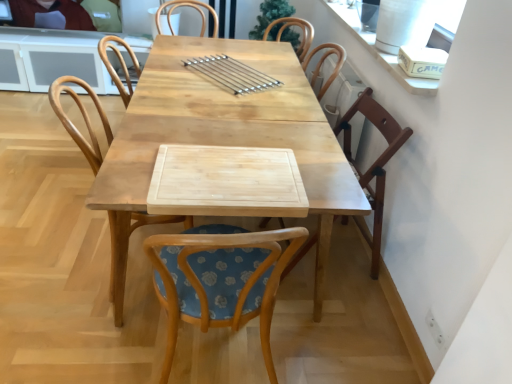
Identify the location of matte black laptop at upper left. (50, 15).

In order to face woodenchair at center, which is counted as the 2th chair, starting from the right, should I rotate leftwards or rightwards?

You should look left and rotate roughly 4.439 degrees.

The height and width of the screenshot is (384, 512). Describe the element at coordinates (221, 139) in the screenshot. I see `natural wood table at center` at that location.

Image resolution: width=512 pixels, height=384 pixels. In order to click on natural wood table at center in this screenshot , I will do `click(221, 139)`.

The height and width of the screenshot is (384, 512). What do you see at coordinates (232, 73) in the screenshot?
I see `satin silver skewers at center` at bounding box center [232, 73].

This screenshot has height=384, width=512. Find the location of `wooden chair at right, which ranks as the 1th chair in right-to-left order`. wooden chair at right, which ranks as the 1th chair in right-to-left order is located at coordinates (373, 164).

Find the location of a particular element. matte black laptop at upper left is located at coordinates (50, 15).

Does wooden chair at right, positioned as the third chair in left-to-right order, touch matte black laptop at upper left?

No, wooden chair at right, positioned as the third chair in left-to-right order, is not touching matte black laptop at upper left.

Which of these two, wooden chair at right, which ranks as the 1th chair in right-to-left order, or matte black laptop at upper left, stands taller?

wooden chair at right, which ranks as the 1th chair in right-to-left order.

From the image's perspective, which chair is the 1st one below the matte black laptop at upper left? Please provide its 2D coordinates.

[(373, 164)]

Is wooden chair at right, which ranks as the 1th chair in right-to-left order, not inside matte black laptop at upper left?

Yes, wooden chair at right, which ranks as the 1th chair in right-to-left order, is not within matte black laptop at upper left.

Between woodenchair at center, which is counted as the 2th chair, starting from the right, and matte black laptop at upper left, which one is positioned behind?

matte black laptop at upper left.

Does woodenchair at center, which is the 2th chair in left-to-right order, turn towards matte black laptop at upper left?

No, woodenchair at center, which is the 2th chair in left-to-right order, is not oriented towards matte black laptop at upper left.

Is woodenchair at center, which is the 2th chair in left-to-right order, far away from matte black laptop at upper left?

That's right, there is a large distance between woodenchair at center, which is the 2th chair in left-to-right order, and matte black laptop at upper left.

Which of these two, woodenchair at center, which is the 2th chair in left-to-right order, or matte black laptop at upper left, is bigger?

With larger size is woodenchair at center, which is the 2th chair in left-to-right order.

Which is more to the right, natural wood table at center or woodenchair at center, which is counted as the 2th chair, starting from the right?

woodenchair at center, which is counted as the 2th chair, starting from the right.

Is point (274, 66) closer or farther from the camera than point (239, 289)?

Point (274, 66).

Based on their sizes in the image, would you say natural wood table at center is bigger or smaller than woodenchair at center, which is counted as the 2th chair, starting from the right?

Considering their sizes, natural wood table at center takes up more space than woodenchair at center, which is counted as the 2th chair, starting from the right.

You are a GUI agent. You are given a task and a screenshot of the screen. Output one action in this format:
    pyautogui.click(x=<x>, y=<y>)
    Task: Click on the table behind the woodenchair at center, which is the 2th chair in left-to-right order
    The image size is (512, 384).
    Given the screenshot: What is the action you would take?
    pyautogui.click(x=221, y=139)

From their relative heights in the image, would you say matte black laptop at upper left is taller or shorter than woodenchair at center, which is the 2th chair in left-to-right order?

matte black laptop at upper left is shorter than woodenchair at center, which is the 2th chair in left-to-right order.

Is matte black laptop at upper left far from woodenchair at center, which is counted as the 2th chair, starting from the right?

matte black laptop at upper left is positioned a significant distance from woodenchair at center, which is counted as the 2th chair, starting from the right.

From a real-world perspective, which object stands above the other?

matte black laptop at upper left, from a real-world perspective.

Where is `the 2nd chair positioned below the matte black laptop at upper left (from a real-world perspective)`? This screenshot has width=512, height=384. the 2nd chair positioned below the matte black laptop at upper left (from a real-world perspective) is located at coordinates (127, 248).

Considering the sizes of objects wooden chair at center, which is counted as the first chair, starting from the left, and matte black laptop at upper left in the image provided, who is smaller, wooden chair at center, which is counted as the first chair, starting from the left, or matte black laptop at upper left?

matte black laptop at upper left.

How much distance is there between wooden chair at center, which is the third chair from right to left, and matte black laptop at upper left?

wooden chair at center, which is the third chair from right to left, and matte black laptop at upper left are 7.04 feet apart.

Is wooden chair at center, which is the third chair from right to left, to the right of matte black laptop at upper left from the viewer's perspective?

Correct, you'll find wooden chair at center, which is the third chair from right to left, to the right of matte black laptop at upper left.

Which is farther from the camera, (12, 12) or (185, 217)?

Point (12, 12)

Is matte black laptop at upper left positioned with its back to wooden chair at center, which is the third chair from right to left?

matte black laptop at upper left is not turned away from wooden chair at center, which is the third chair from right to left.

How distant is matte black laptop at upper left from wooden chair at center, which is counted as the first chair, starting from the left?

matte black laptop at upper left and wooden chair at center, which is counted as the first chair, starting from the left, are 2.15 meters apart from each other.

Does matte black laptop at upper left have a smaller size compared to wooden chair at center, which is counted as the first chair, starting from the left?

Correct, matte black laptop at upper left occupies less space than wooden chair at center, which is counted as the first chair, starting from the left.

I want to click on table below the satin silver skewers at center (from a real-world perspective), so click(221, 139).

Can you confirm if natural wood table at center is wider than satin silver skewers at center?

Correct, the width of natural wood table at center exceeds that of satin silver skewers at center.

How different are the orientations of natural wood table at center and satin silver skewers at center in degrees?

The facing directions of natural wood table at center and satin silver skewers at center are 34.1 degrees apart.

From the picture: Can you confirm if natural wood table at center is shorter than satin silver skewers at center?

No, natural wood table at center is not shorter than satin silver skewers at center.

From a real-world perspective, which chair is the 3rd one underneath the matte black laptop at upper left? Please provide its 2D coordinates.

[(373, 164)]

Which chair is the 3rd one when counting from the front of the matte black laptop at upper left? Please provide its 2D coordinates.

[(220, 279)]

Considering their positions, is matte black laptop at upper left positioned closer to natural wood table at center than satin silver skewers at center?

The object closer to natural wood table at center is satin silver skewers at center.

Based on their spatial positions, is wooden chair at right, positioned as the third chair in left-to-right order, or wooden chair at center, which is the third chair from right to left, closer to natural wood table at center?

The object closer to natural wood table at center is wooden chair at center, which is the third chair from right to left.

When comparing their distances from natural wood table at center, does matte black laptop at upper left or woodenchair at center, which is the 2th chair in left-to-right order, seem closer?

Result: woodenchair at center, which is the 2th chair in left-to-right order, lies closer to natural wood table at center than the other object.

From the image, which object appears to be nearer to woodenchair at center, which is the 2th chair in left-to-right order, wooden chair at center, which is the third chair from right to left, or satin silver skewers at center?

The object closer to woodenchair at center, which is the 2th chair in left-to-right order, is wooden chair at center, which is the third chair from right to left.

From the image, which object appears to be farther from wooden chair at right, which ranks as the 1th chair in right-to-left order, wooden chair at center, which is the third chair from right to left, or natural wood table at center?

wooden chair at center, which is the third chair from right to left, lies further to wooden chair at right, which ranks as the 1th chair in right-to-left order, than the other object.

Considering their positions, is matte black laptop at upper left positioned closer to satin silver skewers at center than wooden chair at center, which is the third chair from right to left?

wooden chair at center, which is the third chair from right to left, is closer to satin silver skewers at center.

Estimate the real-world distances between objects in this image. Which object is further from natural wood table at center, woodenchair at center, which is counted as the 2th chair, starting from the right, or matte black laptop at upper left?

Among the two, matte black laptop at upper left is located further to natural wood table at center.

In the scene shown: Which object lies further to the anchor point wooden chair at center, which is counted as the first chair, starting from the left, matte black laptop at upper left or woodenchair at center, which is the 2th chair in left-to-right order?

matte black laptop at upper left is positioned further to the anchor wooden chair at center, which is counted as the first chair, starting from the left.

You are a GUI agent. You are given a task and a screenshot of the screen. Output one action in this format:
    pyautogui.click(x=<x>, y=<y>)
    Task: Click on the chair between wooden chair at center, which is the third chair from right to left, and matte black laptop at upper left in the front-back direction
    This screenshot has height=384, width=512.
    Given the screenshot: What is the action you would take?
    pyautogui.click(x=373, y=164)

The height and width of the screenshot is (384, 512). In order to click on tableware situated between wooden chair at center, which is counted as the first chair, starting from the left, and wooden chair at right, positioned as the third chair in left-to-right order, from left to right in this screenshot , I will do `click(232, 73)`.

Locate an element on the screen. This screenshot has width=512, height=384. tableware positioned between woodenchair at center, which is counted as the 2th chair, starting from the right, and matte black laptop at upper left from near to far is located at coordinates (232, 73).

This screenshot has width=512, height=384. Identify the location of table between wooden chair at center, which is the third chair from right to left, and wooden chair at right, positioned as the third chair in left-to-right order. (221, 139).